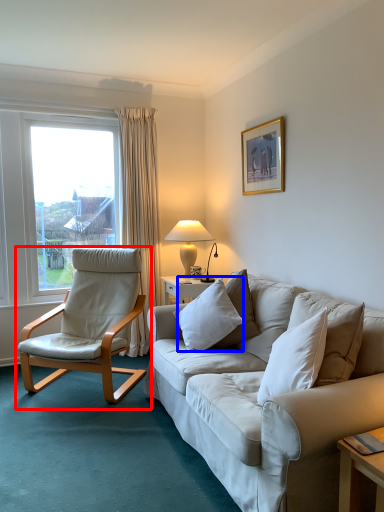
Question: Which point is further to the camera, chair (highlighted by a red box) or pillow (highlighted by a blue box)?

Choices:
 (A) chair
 (B) pillow

Answer: (A)